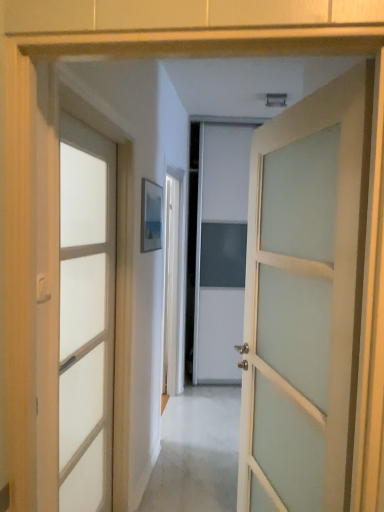
Question: From the image's perspective, is white frosted glass door at center, positioned as the second door in left-to-right order, positioned above or below satin white door at left, marked as the second door in a right-to-left arrangement?

Choices:
 (A) above
 (B) below

Answer: (A)

Question: Is white frosted glass door at center, which is the 1th door in right-to-left order, situated inside satin white door at left, placed as the first door when sorted from left to right, or outside?

Choices:
 (A) outside
 (B) inside

Answer: (A)

Question: Looking at the image, does white frosted glass door at center, which is the 1th door in right-to-left order, seem bigger or smaller compared to satin white door at left, placed as the first door when sorted from left to right?

Choices:
 (A) big
 (B) small

Answer: (A)

Question: Is satin white door at left, placed as the first door when sorted from left to right, inside or outside of white frosted glass door at center, positioned as the second door in left-to-right order?

Choices:
 (A) outside
 (B) inside

Answer: (A)

Question: Does point (97, 481) appear closer or farther from the camera than point (345, 442)?

Choices:
 (A) closer
 (B) farther

Answer: (B)

Question: From a real-world perspective, relative to white frosted glass door at center, which is the 1th door in right-to-left order, is satin white door at left, placed as the first door when sorted from left to right, vertically above or below?

Choices:
 (A) above
 (B) below

Answer: (B)

Question: In the image, is satin white door at left, marked as the second door in a right-to-left arrangement, positioned in front of or behind white frosted glass door at center, which is the 1th door in right-to-left order?

Choices:
 (A) behind
 (B) front

Answer: (A)